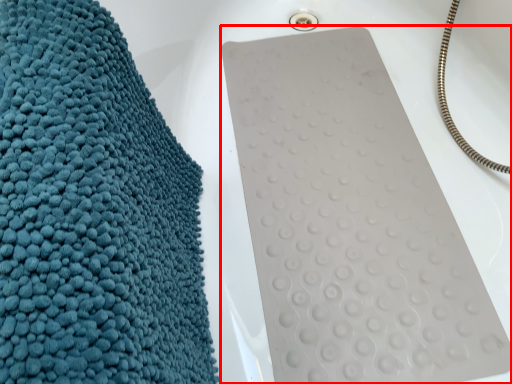
Question: From the image's perspective, where is bath towel (annotated by the red box) located in relation to towel in the image?

Choices:
 (A) above
 (B) below

Answer: (A)